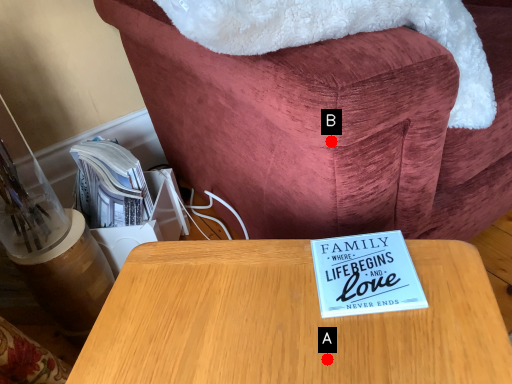
Question: Two points are circled on the image, labeled by A and B beside each circle. Which of the following is the closest to the observer?

Choices:
 (A) A is closer
 (B) B is closer

Answer: (A)